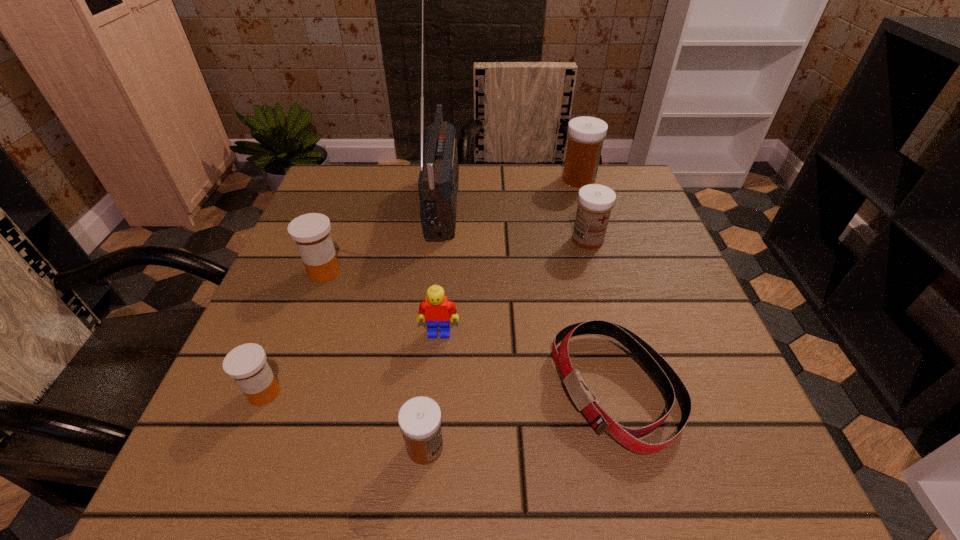
Identify the location of unoccupied area between the second tallest object and the pink dog collar. (597, 284).

In order to click on unoccupied area between the nearest white medicine and the shortest object in this screenshot , I will do `click(520, 418)`.

At what (x,y) coordinates should I click in order to perform the action: click on unoccupied area between the biggest white medicine and the smaller orange medicine. Please return your answer as a coordinate pair (x, y). Image resolution: width=960 pixels, height=540 pixels. Looking at the image, I should click on (421, 286).

The image size is (960, 540). I want to click on free space between the smallest white medicine and the biggest white medicine, so click(502, 313).

You are a GUI agent. You are given a task and a screenshot of the screen. Output one action in this format:
    pyautogui.click(x=<x>, y=<y>)
    Task: Click on the free space between the fourth nearest medicine and the third farthest medicine
    The image size is (960, 540).
    Given the screenshot: What is the action you would take?
    pyautogui.click(x=456, y=256)

Find the location of a particular element. The width and height of the screenshot is (960, 540). the seventh closest object relative to the fourth farthest object is located at coordinates (586, 134).

You are a GUI agent. You are given a task and a screenshot of the screen. Output one action in this format:
    pyautogui.click(x=<x>, y=<y>)
    Task: Click on the object that is the second closest one to the dog collar
    
    Given the screenshot: What is the action you would take?
    pyautogui.click(x=419, y=418)

Locate an element on the screen. the third closest medicine to the nearest white medicine is located at coordinates (595, 201).

Locate which medicine ranks third in proximity to the farthest white medicine. Please provide its 2D coordinates. Your answer should be formatted as a tuple, i.e. [(x, y)], where the tuple contains the x and y coordinates of a point satisfying the conditions above.

[(419, 418)]

The width and height of the screenshot is (960, 540). What are the coordinates of `white medicine that stands as the second closest to the smallest white medicine` in the screenshot? It's located at (586, 134).